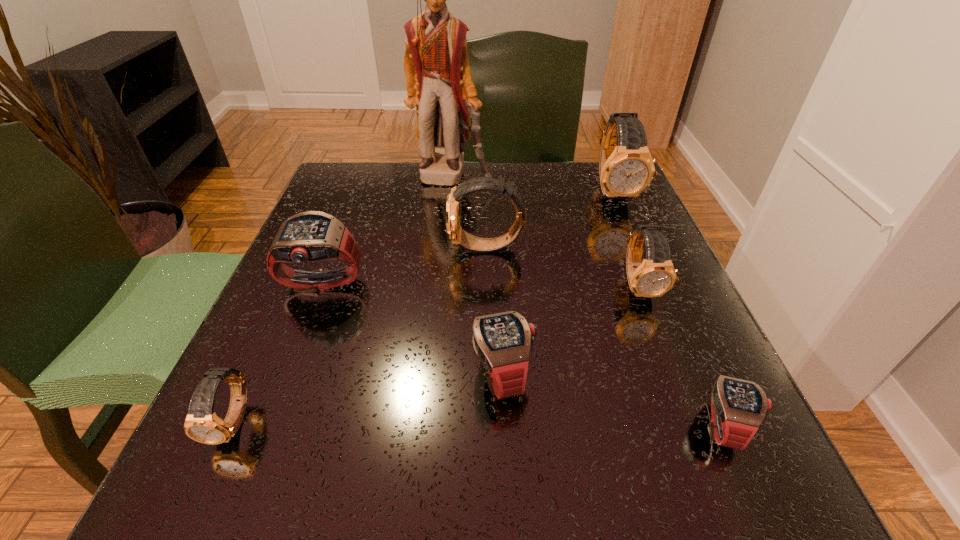
Locate an element on the screen. This screenshot has width=960, height=540. nutcracker is located at coordinates (436, 64).

This screenshot has height=540, width=960. What are the coordinates of `the tallest object` in the screenshot? It's located at (436, 64).

This screenshot has height=540, width=960. What are the coordinates of `the farthest watch` in the screenshot? It's located at (626, 168).

Find the location of a particular element. The height and width of the screenshot is (540, 960). the farthest gold watch is located at coordinates (626, 168).

Where is `the third smallest gold watch`? The height and width of the screenshot is (540, 960). the third smallest gold watch is located at coordinates [x=458, y=236].

The image size is (960, 540). I want to click on the third nearest gold watch, so click(x=458, y=236).

Where is `the biggest red watch`? the biggest red watch is located at coordinates (307, 237).

Where is `the leftmost red watch`? the leftmost red watch is located at coordinates (307, 237).

The image size is (960, 540). In order to click on the second smallest gold watch in this screenshot , I will do `click(655, 275)`.

Find the location of a particular element. the second smallest red watch is located at coordinates (503, 341).